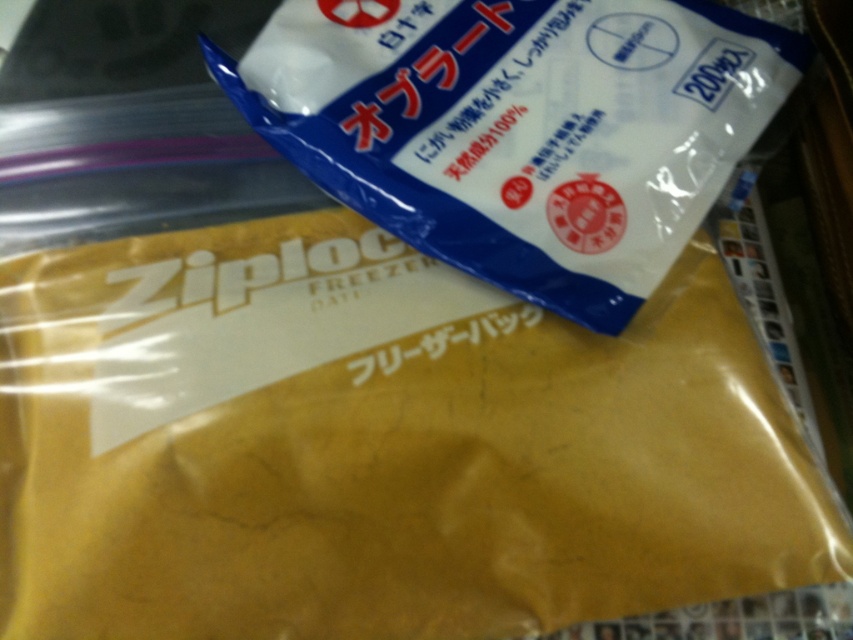
Can you confirm if yellow matte ziploc bag at center is smaller than blue paper bag at upper center?

No.

The height and width of the screenshot is (640, 853). What do you see at coordinates (378, 444) in the screenshot? I see `yellow matte ziploc bag at center` at bounding box center [378, 444].

The width and height of the screenshot is (853, 640). Describe the element at coordinates (378, 444) in the screenshot. I see `yellow matte ziploc bag at center` at that location.

Where is `yellow matte ziploc bag at center`? The height and width of the screenshot is (640, 853). yellow matte ziploc bag at center is located at coordinates (378, 444).